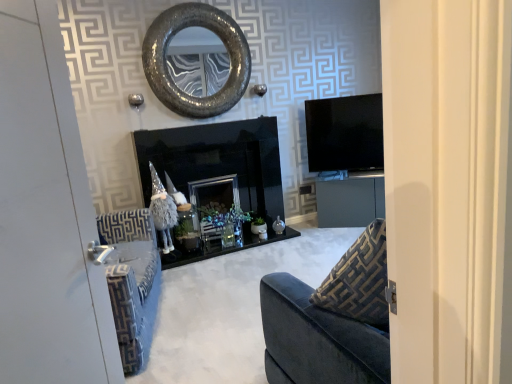
Describe the element at coordinates (46, 216) in the screenshot. I see `white painted wood door at left` at that location.

Locate an element on the screen. The height and width of the screenshot is (384, 512). textured metallic mirror at upper center is located at coordinates (166, 63).

Is black glossy fireplace at center positioned with its back to matte gray cabinet at center?

No, black glossy fireplace at center is not facing away from matte gray cabinet at center.

Who is taller, black glossy fireplace at center or matte gray cabinet at center?

With more height is black glossy fireplace at center.

Identify the location of fireplace above the matte gray cabinet at center (from a real-world perspective). The height and width of the screenshot is (384, 512). (217, 179).

Is black glossy fireplace at center positioned beyond the bounds of matte gray cabinet at center?

Yes, black glossy fireplace at center is located beyond the bounds of matte gray cabinet at center.

Considering the sizes of objects white painted wood door at left and matte gray cabinet at center in the image provided, who is smaller, white painted wood door at left or matte gray cabinet at center?

Smaller between the two is white painted wood door at left.

Looking at this image, could you tell me if white painted wood door at left is turned towards matte gray cabinet at center?

No, white painted wood door at left is not oriented towards matte gray cabinet at center.

From the image's perspective, is white painted wood door at left under matte gray cabinet at center?

Yes, from the image's perspective, white painted wood door at left is beneath matte gray cabinet at center.

Are white painted wood door at left and matte gray cabinet at center far apart?

white painted wood door at left is positioned a significant distance from matte gray cabinet at center.

Is white painted wood door at left positioned behind textured metallic mirror at upper center?

No, white painted wood door at left is closer to the viewer.

Can you tell me how much white painted wood door at left and textured metallic mirror at upper center differ in facing direction?

There is a 67.1-degree angle between the facing directions of white painted wood door at left and textured metallic mirror at upper center.

From the image's perspective, is white painted wood door at left located above or below textured metallic mirror at upper center?

Based on their image positions, white painted wood door at left is located beneath textured metallic mirror at upper center.

How much distance is there between white painted wood door at left and textured metallic mirror at upper center?

2.74 meters.

Is textured metallic mirror at upper center at the left side of white painted wood door at left?

Yes, textured metallic mirror at upper center is to the left of white painted wood door at left.

Does textured metallic mirror at upper center have a greater width compared to white painted wood door at left?

No, textured metallic mirror at upper center is not wider than white painted wood door at left.

From the image's perspective, which one is positioned higher, textured metallic mirror at upper center or white painted wood door at left?

textured metallic mirror at upper center.

In terms of height, does textured metallic mirror at upper center look taller or shorter compared to white painted wood door at left?

Considering their sizes, textured metallic mirror at upper center has less height than white painted wood door at left.

Can you tell me how much textured metallic mirror at upper center and matte gray cabinet at center differ in facing direction?

The facing directions of textured metallic mirror at upper center and matte gray cabinet at center are 33.2 degrees apart.

From a real-world perspective, which object rests below the other?

In real-world perspective, matte gray cabinet at center is lower.

Where is `cabinetry below the textured metallic mirror at upper center (from the image's perspective)`? Image resolution: width=512 pixels, height=384 pixels. cabinetry below the textured metallic mirror at upper center (from the image's perspective) is located at coordinates (350, 201).

Which is more to the right, textured metallic mirror at upper center or matte gray cabinet at center?

From the viewer's perspective, matte gray cabinet at center appears more on the right side.

Which object is closer to the camera, matte gray cabinet at center or black glossy fireplace at center?

black glossy fireplace at center is closer to the camera.

Where is `fireplace that appears above the matte gray cabinet at center (from the image's perspective)`? fireplace that appears above the matte gray cabinet at center (from the image's perspective) is located at coordinates (217, 179).

Is matte gray cabinet at center turned away from black glossy fireplace at center?

That's not correct — matte gray cabinet at center is not looking away from black glossy fireplace at center.

Looking at this image, are matte gray cabinet at center and black glossy fireplace at center making contact?

No, matte gray cabinet at center is not beside black glossy fireplace at center.

From a real-world perspective, which object stands above the other?

In real-world perspective, white painted wood door at left is above.

Which is closer to the camera, (220, 197) or (81, 152)?

Point (220, 197) is farther from the camera than point (81, 152).

Considering the positions of objects black glossy fireplace at center and white painted wood door at left in the image provided, who is more to the right, black glossy fireplace at center or white painted wood door at left?

black glossy fireplace at center.

Are black glossy fireplace at center and white painted wood door at left far apart?

black glossy fireplace at center is positioned a significant distance from white painted wood door at left.

This screenshot has height=384, width=512. Find the location of `cabinetry on the right of black glossy fireplace at center`. cabinetry on the right of black glossy fireplace at center is located at coordinates (350, 201).

Locate an element on the screen. Image resolution: width=512 pixels, height=384 pixels. door that is above the matte gray cabinet at center (from a real-world perspective) is located at coordinates (46, 216).

When comparing their distances from matte gray cabinet at center, does textured metallic mirror at upper center or white painted wood door at left seem further?

The object further to matte gray cabinet at center is white painted wood door at left.

Based on their spatial positions, is matte gray cabinet at center or white painted wood door at left further from black glossy fireplace at center?

white painted wood door at left lies further to black glossy fireplace at center than the other object.

Looking at this image, looking at the image, which one is located closer to matte gray cabinet at center, textured metallic mirror at upper center or black glossy fireplace at center?

Among the two, black glossy fireplace at center is located nearer to matte gray cabinet at center.

Which object lies nearer to the anchor point matte gray cabinet at center, white painted wood door at left or textured metallic mirror at upper center?

Among the two, textured metallic mirror at upper center is located nearer to matte gray cabinet at center.

Based on their spatial positions, is white painted wood door at left or matte gray cabinet at center further from black glossy fireplace at center?

white painted wood door at left is positioned further to the anchor black glossy fireplace at center.

Looking at this image, estimate the real-world distances between objects in this image. Which object is further from textured metallic mirror at upper center, matte gray cabinet at center or black glossy fireplace at center?

The object further to textured metallic mirror at upper center is matte gray cabinet at center.

From the image, which object appears to be nearer to textured metallic mirror at upper center, white painted wood door at left or matte gray cabinet at center?

matte gray cabinet at center is positioned closer to the anchor textured metallic mirror at upper center.

Considering their positions, is white painted wood door at left positioned closer to textured metallic mirror at upper center than black glossy fireplace at center?

The object closer to textured metallic mirror at upper center is black glossy fireplace at center.

Where is `fireplace positioned between white painted wood door at left and matte gray cabinet at center from near to far`? fireplace positioned between white painted wood door at left and matte gray cabinet at center from near to far is located at coordinates (217, 179).

The image size is (512, 384). Find the location of `fireplace between textured metallic mirror at upper center and matte gray cabinet at center in the horizontal direction`. fireplace between textured metallic mirror at upper center and matte gray cabinet at center in the horizontal direction is located at coordinates (217, 179).

I want to click on fireplace located between white painted wood door at left and textured metallic mirror at upper center in the depth direction, so click(x=217, y=179).

I want to click on oval located between white painted wood door at left and matte gray cabinet at center in the depth direction, so click(166, 63).